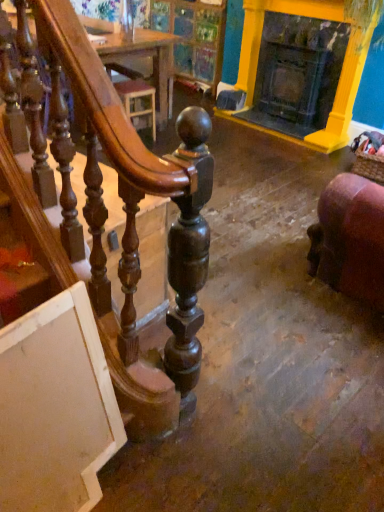
Question: From the image's perspective, would you say wooden table at upper center is positioned over purple velvet chair at lower right?

Choices:
 (A) no
 (B) yes

Answer: (B)

Question: Does wooden table at upper center have a greater height compared to purple velvet chair at lower right?

Choices:
 (A) no
 (B) yes

Answer: (A)

Question: Is wooden table at upper center positioned in front of purple velvet chair at lower right?

Choices:
 (A) no
 (B) yes

Answer: (A)

Question: From the image's perspective, is wooden table at upper center beneath purple velvet chair at lower right?

Choices:
 (A) yes
 (B) no

Answer: (B)

Question: Considering the relative positions of wooden table at upper center and purple velvet chair at lower right in the image provided, is wooden table at upper center to the right of purple velvet chair at lower right from the viewer's perspective?

Choices:
 (A) no
 (B) yes

Answer: (A)

Question: Is wooden table at upper center facing towards purple velvet chair at lower right?

Choices:
 (A) yes
 (B) no

Answer: (B)

Question: Considering the relative sizes of yellow painted wood fireplace at upper right and wooden table at upper center in the image provided, is yellow painted wood fireplace at upper right shorter than wooden table at upper center?

Choices:
 (A) no
 (B) yes

Answer: (A)

Question: From a real-world perspective, is yellow painted wood fireplace at upper right beneath wooden table at upper center?

Choices:
 (A) yes
 (B) no

Answer: (B)

Question: Is wooden table at upper center surrounded by yellow painted wood fireplace at upper right?

Choices:
 (A) no
 (B) yes

Answer: (A)

Question: From the image's perspective, is yellow painted wood fireplace at upper right located beneath wooden table at upper center?

Choices:
 (A) no
 (B) yes

Answer: (B)

Question: From the image's perspective, is yellow painted wood fireplace at upper right on top of wooden table at upper center?

Choices:
 (A) no
 (B) yes

Answer: (A)

Question: Is yellow painted wood fireplace at upper right at the left side of wooden table at upper center?

Choices:
 (A) no
 (B) yes

Answer: (A)

Question: Considering the relative sizes of wooden table at upper center and yellow painted wood fireplace at upper right in the image provided, is wooden table at upper center smaller than yellow painted wood fireplace at upper right?

Choices:
 (A) no
 (B) yes

Answer: (A)